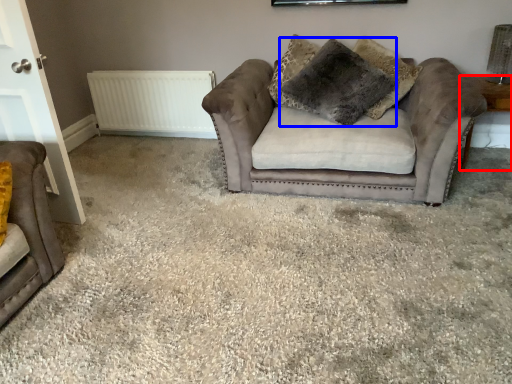
Question: Among these objects, which one is farthest to the camera, side table (highlighted by a red box) or pillow (highlighted by a blue box)?

Choices:
 (A) side table
 (B) pillow

Answer: (A)